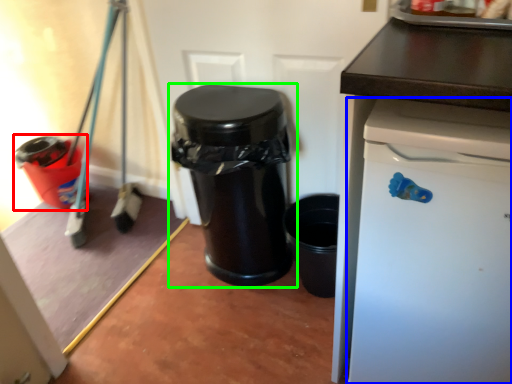
Question: Which object is the closest to the waste container (highlighted by a red box)? Choose among these: dish washer (highlighted by a blue box) or waste container (highlighted by a green box).

Choices:
 (A) dish washer
 (B) waste container

Answer: (B)